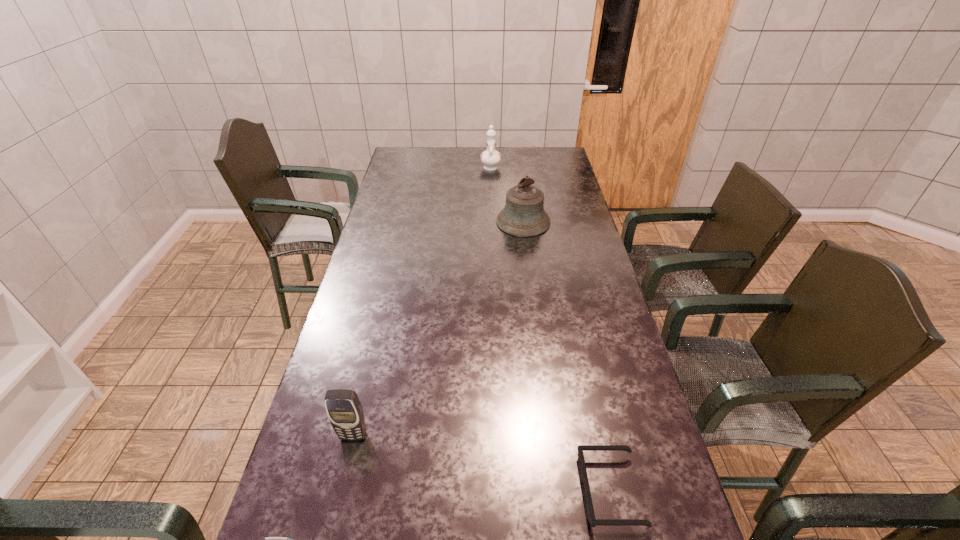
Where is `the farthest object`? the farthest object is located at coordinates pyautogui.click(x=490, y=158).

I want to click on bell, so click(523, 215).

Identify the location of the third farthest object. This screenshot has height=540, width=960. (344, 409).

Identify the location of the farther cellular telephone. The height and width of the screenshot is (540, 960). (344, 409).

You are a GUI agent. You are given a task and a screenshot of the screen. Output one action in this format:
    pyautogui.click(x=<x>, y=<y>)
    Task: Click on the sunglasses
    The height and width of the screenshot is (540, 960).
    Given the screenshot: What is the action you would take?
    pyautogui.click(x=590, y=514)

The image size is (960, 540). What are the coordinates of `the shortest object` in the screenshot? It's located at (590, 514).

Locate an element on the screen. The image size is (960, 540). vacant space located on the front of the fourth nearest object is located at coordinates (534, 299).

The width and height of the screenshot is (960, 540). Identify the location of free space located on the front face of the third nearest object. (333, 523).

Identify the location of blank space located 0.330m on the front-facing side of the sunglasses. The width and height of the screenshot is (960, 540). (432, 490).

Identify the location of free location located 0.360m on the front-facing side of the sunglasses. (419, 490).